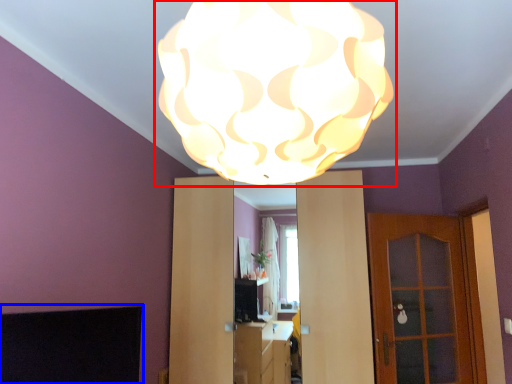
Question: Which of the following is the closest to the observer, lamp (highlighted by a red box) or fireplace (highlighted by a blue box)?

Choices:
 (A) lamp
 (B) fireplace

Answer: (A)